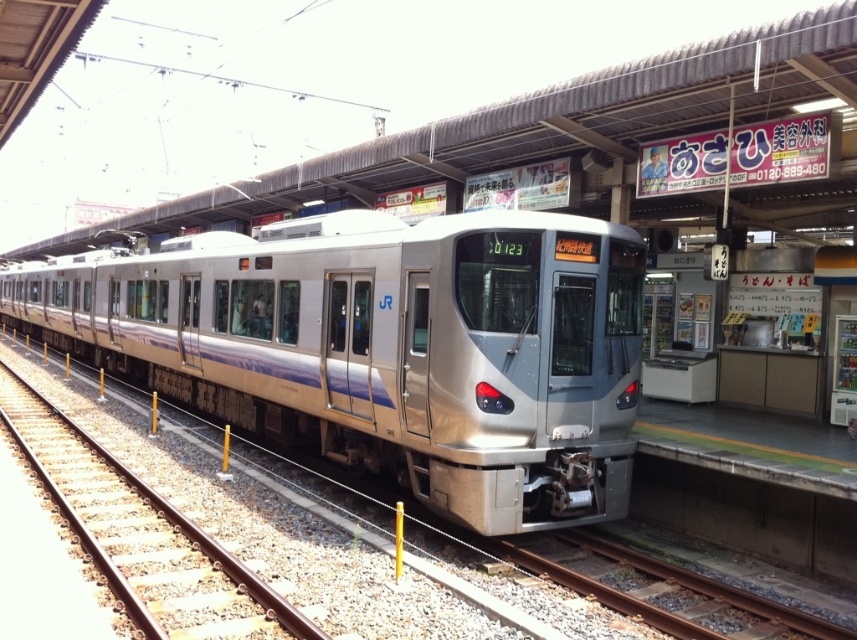
You are a passenger waiting at the station platform. You see the silver metallic train at center and the rusty metal train track at lower center. Which object is bigger in size?

The silver metallic train at center is larger in size than the rusty metal train track at lower center.

You are standing at the station platform and want to take a photo of the silver metallic train at center. If your camera can focus up to 25 feet away, will you be able to capture the train clearly?

The silver metallic train at center and camera are 24.31 feet apart from each other. Since the camera can focus up to 25 feet away, the distance of 24.31 feet is within the focus range. Therefore, you can capture the train clearly.